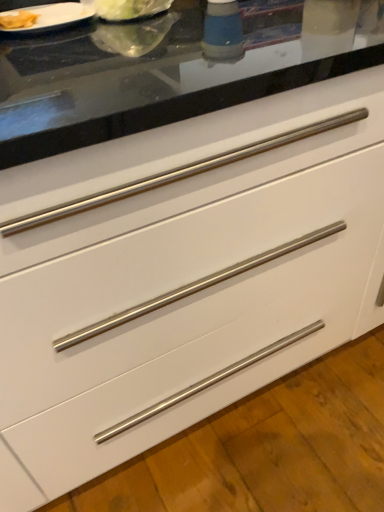
Find the location of a particular element. white glossy plate at upper left is located at coordinates (51, 17).

What do you see at coordinates (51, 17) in the screenshot?
I see `white glossy plate at upper left` at bounding box center [51, 17].

Locate an element on the screen. The image size is (384, 512). white glossy plate at upper left is located at coordinates (51, 17).